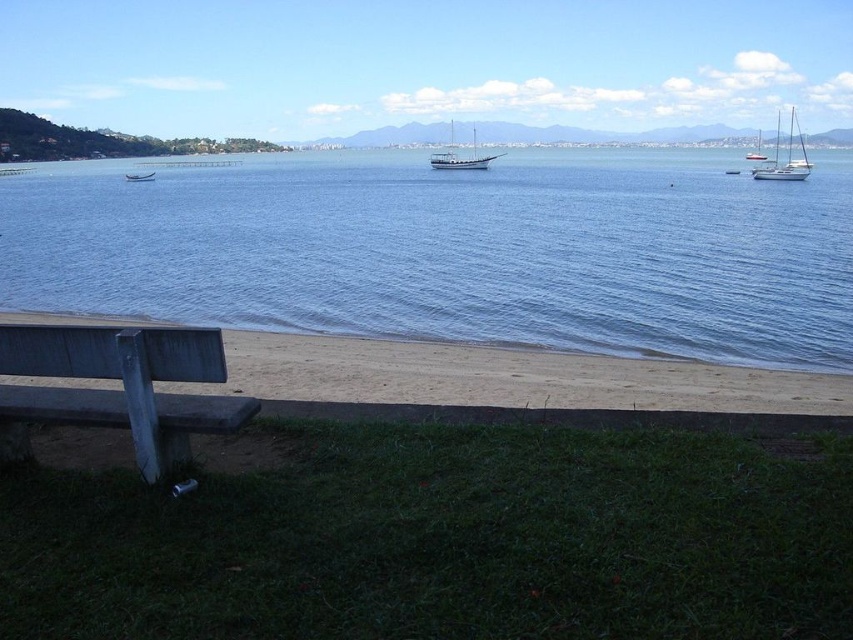
Is blue water at center wider than light brown sand at lower center?

Yes, blue water at center is wider than light brown sand at lower center.

Looking at this image, does blue water at center appear under light brown sand at lower center?

Actually, blue water at center is above light brown sand at lower center.

In order to click on blue water at center in this screenshot , I will do `click(451, 250)`.

Who is more forward, (438,385) or (126,179)?

Positioned in front is point (438,385).

Which is more to the left, light brown sand at lower center or wooden canoe at center?

wooden canoe at center

In order to click on light brown sand at lower center in this screenshot , I will do `click(505, 380)`.

Image resolution: width=853 pixels, height=640 pixels. In order to click on gray wooden bench at lower left in this screenshot , I will do `click(117, 390)`.

Is point (206, 372) farther from viewer compared to point (151, 172)?

No.

Is point (9, 387) farther from viewer compared to point (148, 179)?

That is False.

Where is `gray wooden bench at lower left`? The image size is (853, 640). gray wooden bench at lower left is located at coordinates point(117,390).